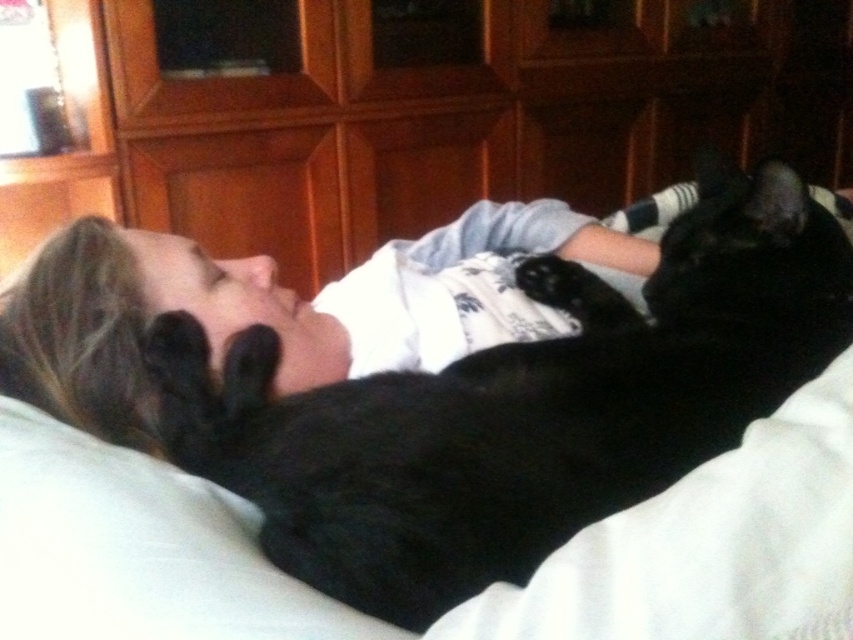
Between point (621, 429) and point (3, 628), which one is positioned in front?

Point (3, 628) is in front.

The image size is (853, 640). What do you see at coordinates (519, 406) in the screenshot?
I see `black fur cat at upper center` at bounding box center [519, 406].

Between point (167, 440) and point (184, 552), which one is positioned in front?

Positioned in front is point (184, 552).

The height and width of the screenshot is (640, 853). What are the coordinates of `black fur cat at upper center` in the screenshot? It's located at (519, 406).